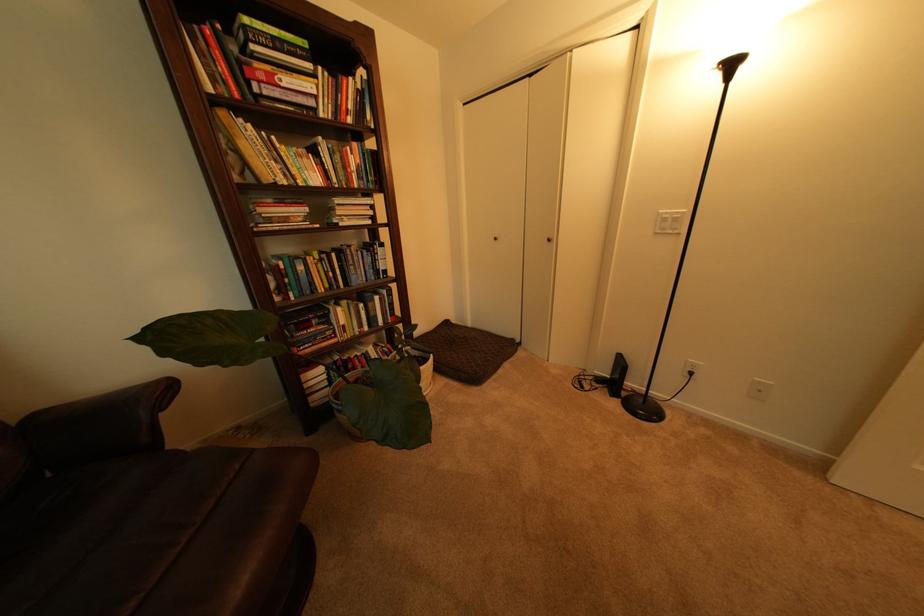
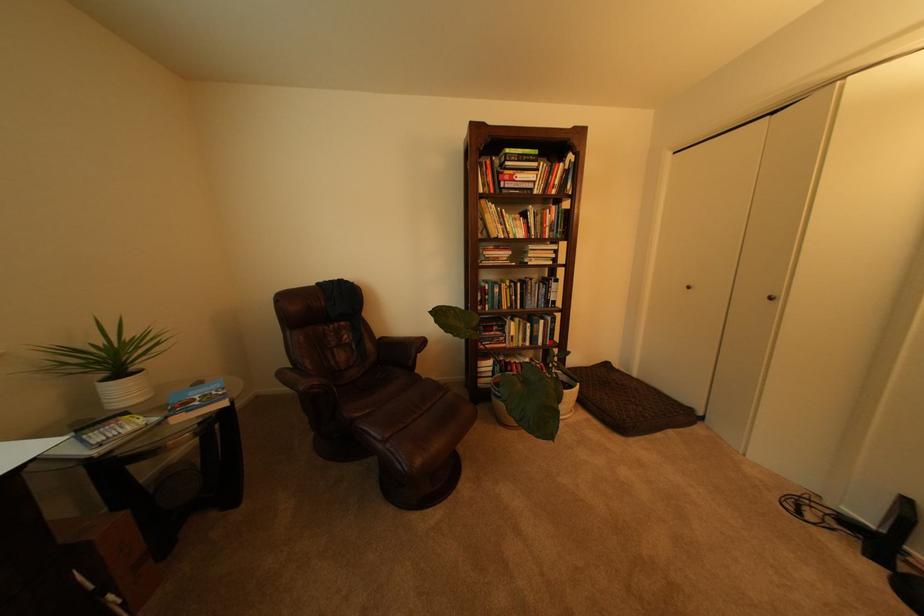
The point at (432, 370) is marked in the first image. Where is the corresponding point in the second image?

(576, 392)